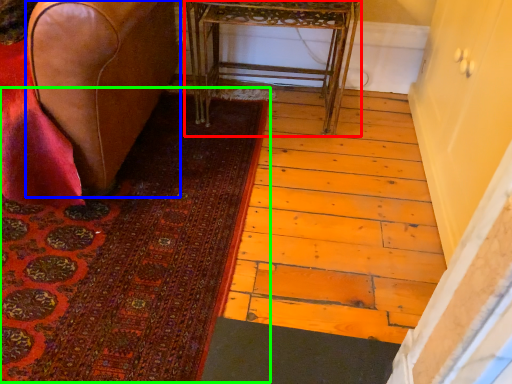
Question: Estimate the real-world distances between objects in this image. Which object is closer to table (highlighted by a red box), furniture (highlighted by a blue box) or mat (highlighted by a green box)?

Choices:
 (A) furniture
 (B) mat

Answer: (A)